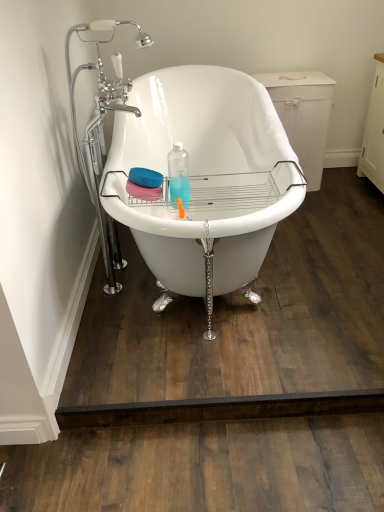
Question: Would you say white glossy bathtub at center is inside or outside chrome/metallic faucet at upper left?

Choices:
 (A) inside
 (B) outside

Answer: (B)

Question: Considering the positions of white glossy bathtub at center and chrome/metallic faucet at upper left in the image, is white glossy bathtub at center taller or shorter than chrome/metallic faucet at upper left?

Choices:
 (A) tall
 (B) short

Answer: (B)

Question: Considering the positions of point (137, 130) and point (77, 157), is point (137, 130) closer or farther from the camera than point (77, 157)?

Choices:
 (A) farther
 (B) closer

Answer: (A)

Question: Is chrome/metallic faucet at upper left in front of or behind white glossy bathtub at center in the image?

Choices:
 (A) front
 (B) behind

Answer: (B)

Question: Visually, is chrome/metallic faucet at upper left positioned to the left or to the right of white glossy bathtub at center?

Choices:
 (A) left
 (B) right

Answer: (A)

Question: Is point (102, 109) positioned closer to the camera than point (248, 92)?

Choices:
 (A) closer
 (B) farther

Answer: (A)

Question: Considering the positions of chrome/metallic faucet at upper left and white glossy bathtub at center in the image, is chrome/metallic faucet at upper left wider or thinner than white glossy bathtub at center?

Choices:
 (A) thin
 (B) wide

Answer: (A)